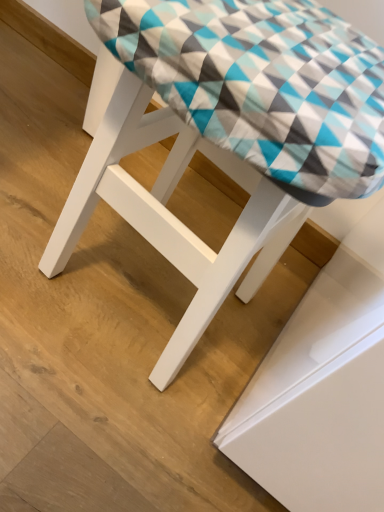
The height and width of the screenshot is (512, 384). Find the location of `vacant region in front of white matte stool at center`. vacant region in front of white matte stool at center is located at coordinates (92, 416).